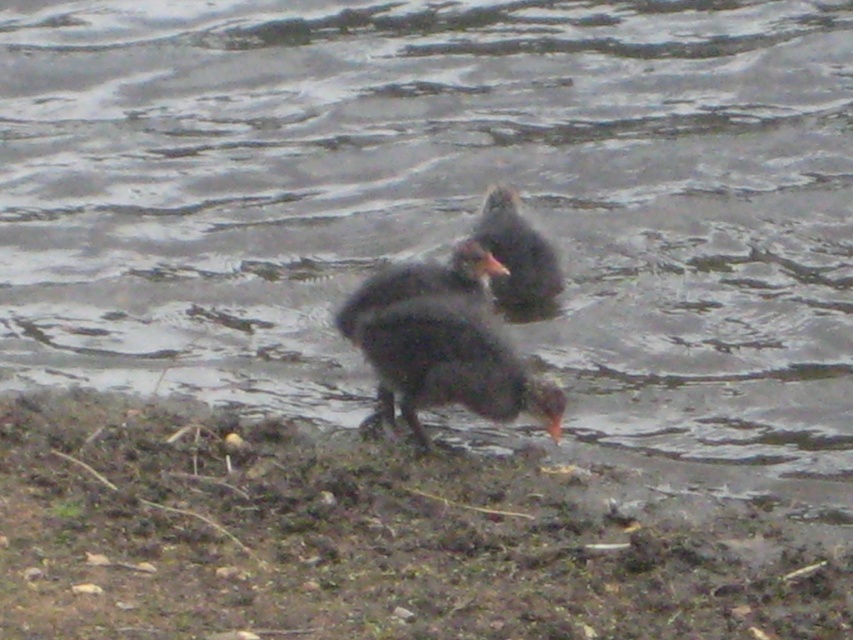
Question: Which object is the closest to the orange matte beak at center?

Choices:
 (A) brown muddy ground at lower center
 (B) dark gray feathers duck at center
 (C) dark feathered bird at center

Answer: (B)

Question: Is dark feathered bird at center wider than dark gray feathers duck at center?

Choices:
 (A) no
 (B) yes

Answer: (B)

Question: Among these points, which one is nearest to the camera?

Choices:
 (A) (492, 268)
 (B) (512, 211)
 (C) (264, 536)
 (D) (404, 310)

Answer: (C)

Question: Is dark feathered bird at center closer to camera compared to dark gray feathers duck at center?

Choices:
 (A) yes
 (B) no

Answer: (A)

Question: Which object is farther from the camera taking this photo?

Choices:
 (A) orange matte beak at center
 (B) brown muddy ground at lower center
 (C) dark feathered bird at center
 (D) dark gray feathers duck at center

Answer: (D)

Question: Where is dark feathered bird at center located in relation to dark gray feathers duck at center in the image?

Choices:
 (A) right
 (B) left

Answer: (B)